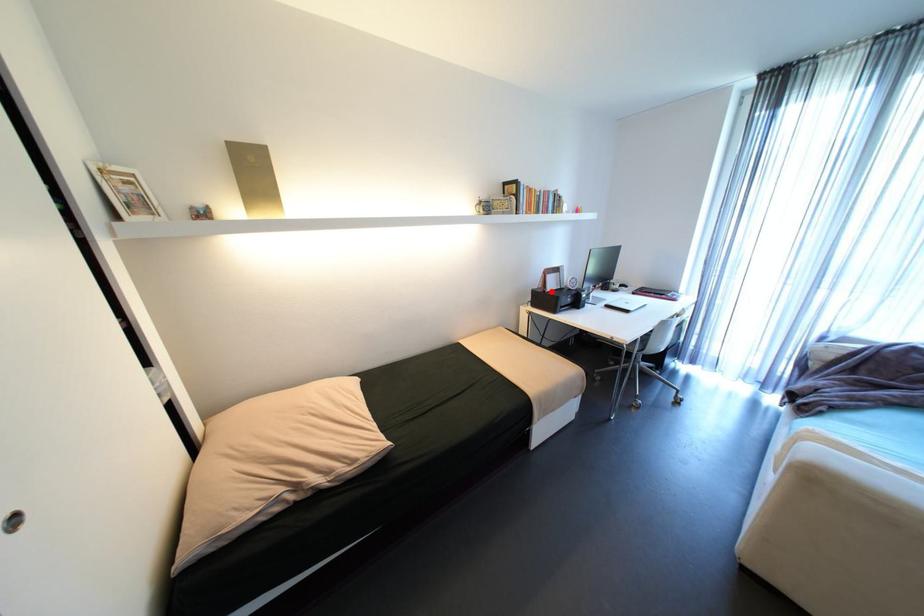
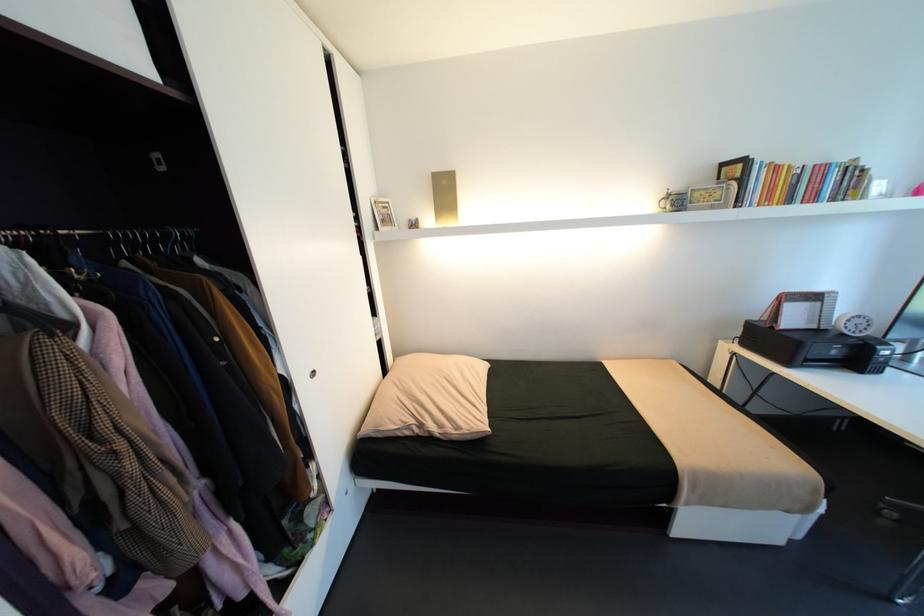
Locate, in the second image, the point that corresponds to the highlighted location in the first image.

(779, 328)